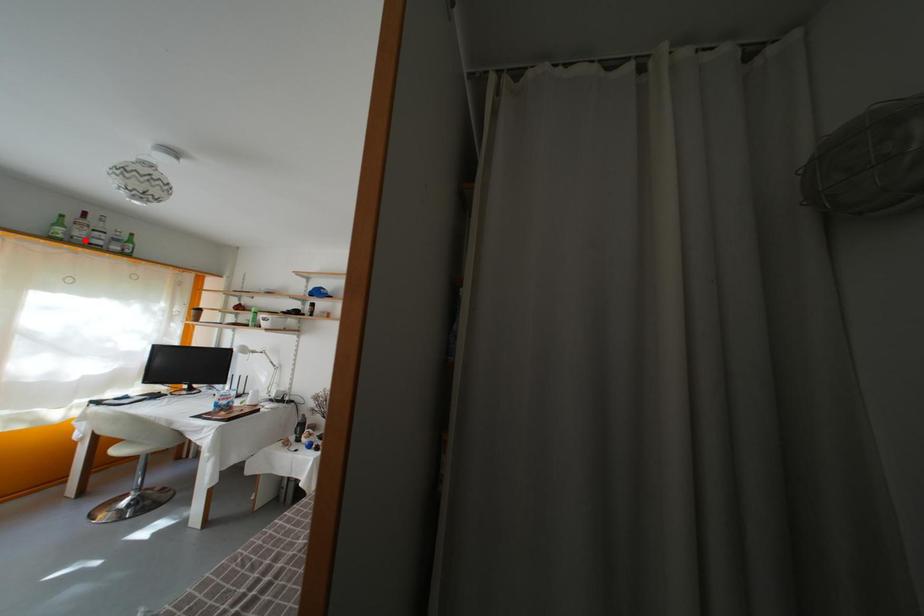
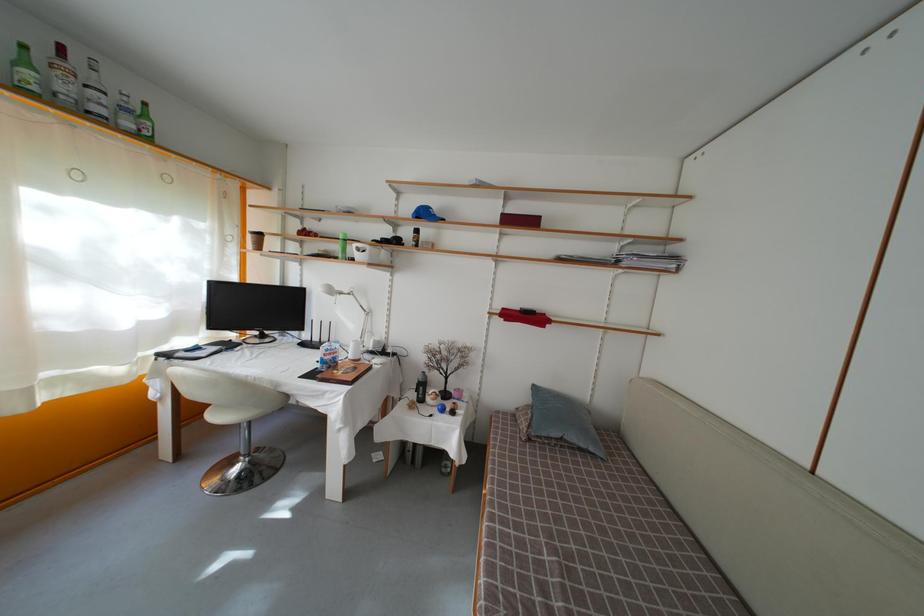
Question: I am providing you with two images of the same scene from different viewpoints. A red point is marked on the first image. At the location where the point appears in image 1, is it still visible in image 2?

Choices:
 (A) Yes
 (B) No

Answer: (A)